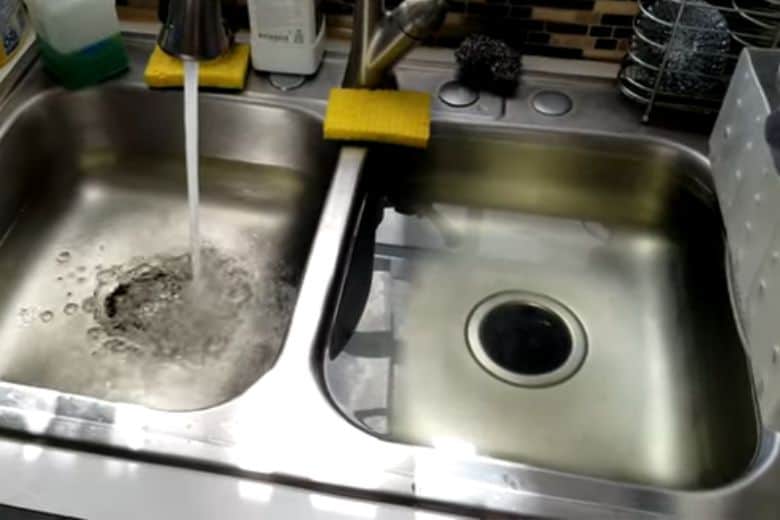
Locate an element on the screen. The height and width of the screenshot is (520, 780). silver tap is located at coordinates (376, 47), (195, 39).